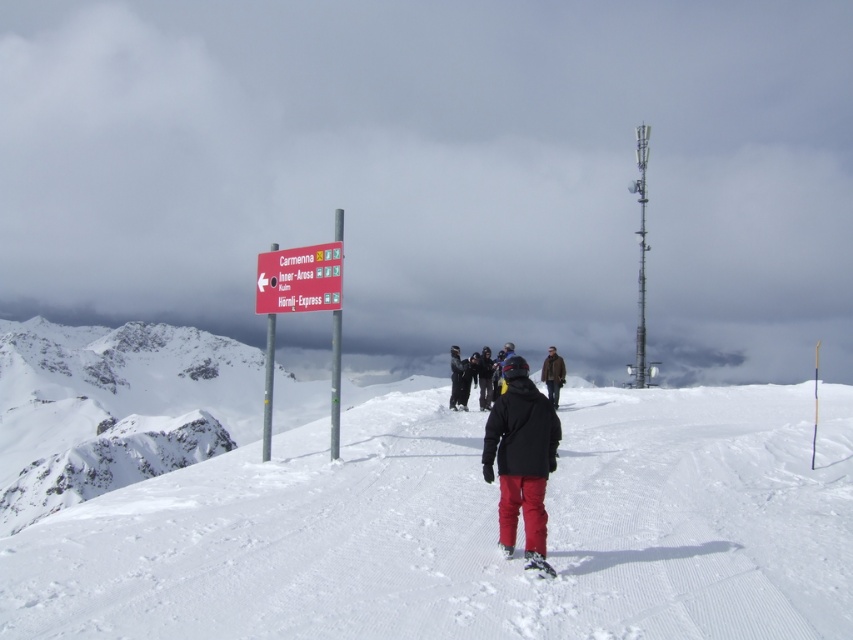
Looking at this image, you are a hiker trying to decide which jacket to wear based on the image. There is a black matte jacket at center and a black jacket at center. Which one is on the right side?

The black matte jacket at center is positioned on the right side of the black jacket at center.

You are planning a hike and need to check if the snow is deep enough to support your weight. Based on the image, is the white powdery snow at center under the black matte jacket at center thick enough to hold a person?

The white powdery snow at center is below black matte jacket at center, which suggests that the snow is thick enough to support the weight of a person since the jacket is on top of it.

You are a skier planning to descend the slope. You notice the cloudy sky at upper center and the white plastic ski at center. Which object is closer to you as you stand on the slope?

The cloudy sky at upper center is closer to you because it is further to the viewer than the white plastic ski at center.